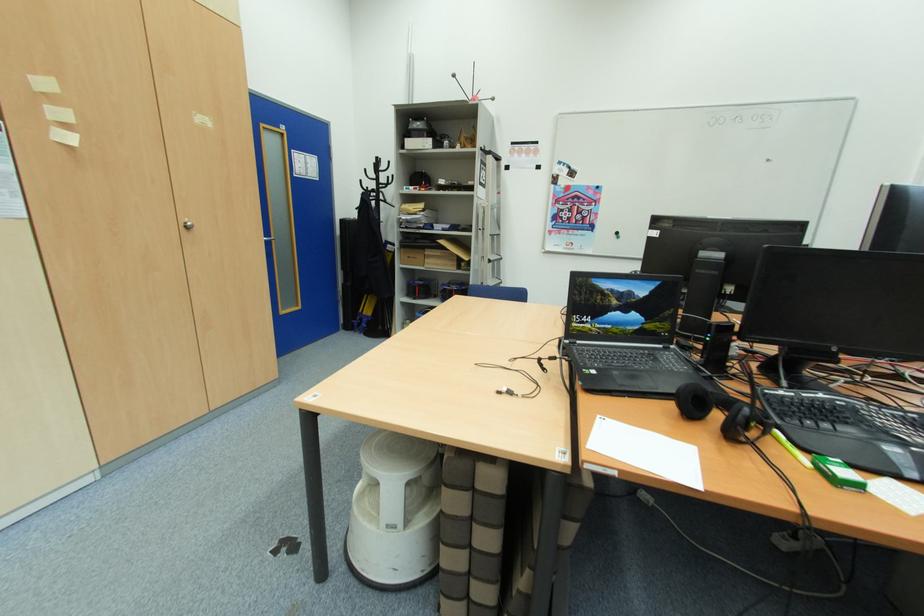
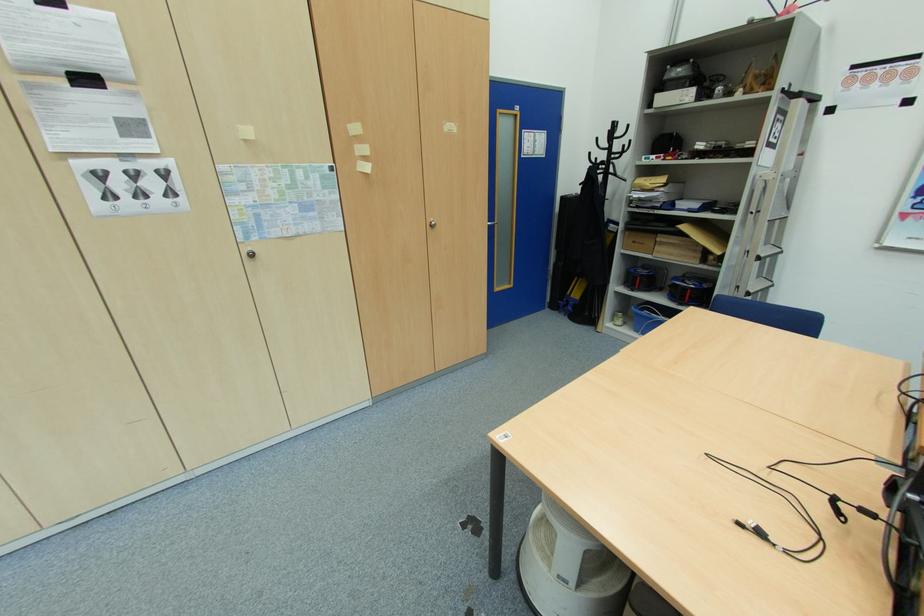
Locate, in the second image, the point that corresponds to (x=428, y=249) in the first image.

(660, 233)